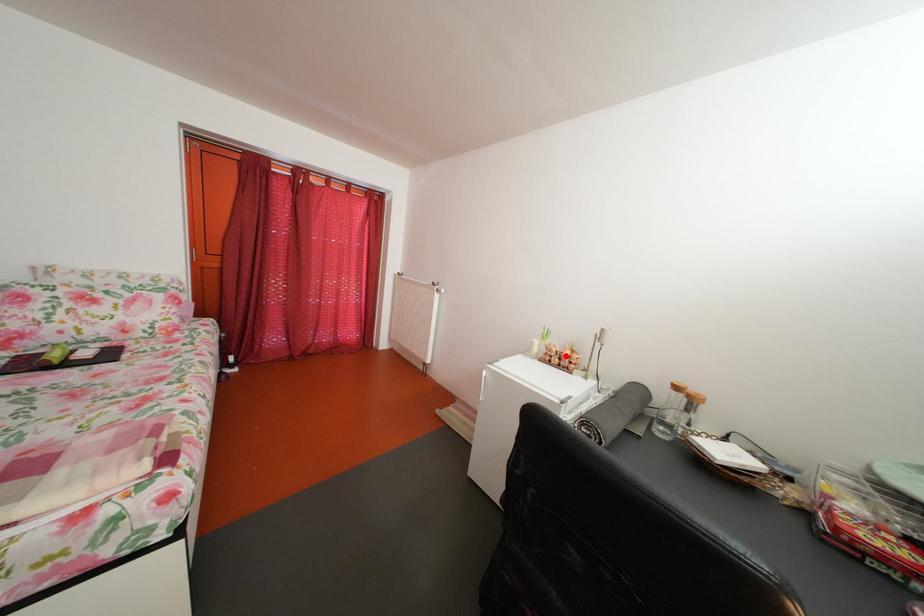
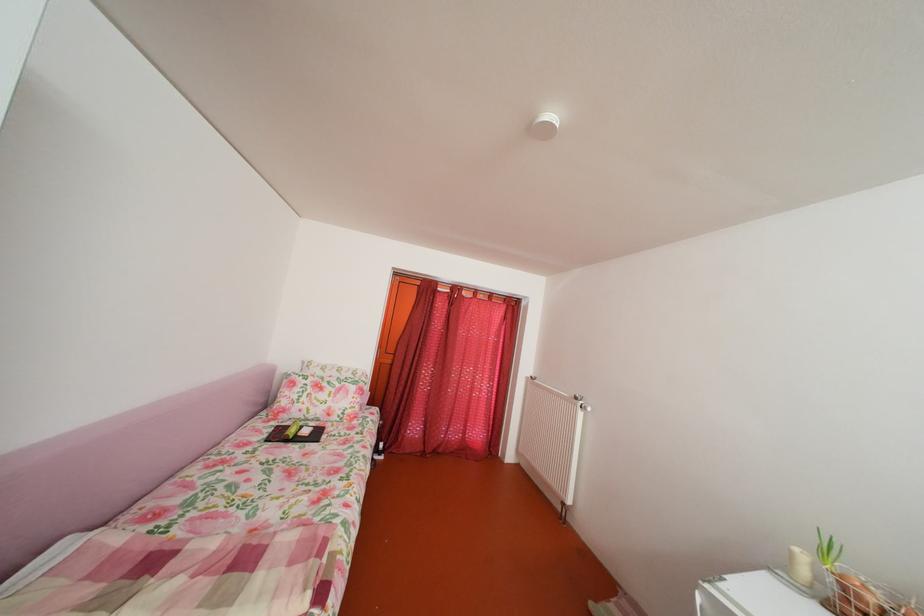
Question: I am providing you with two images of the same scene from different viewpoints. A red point is shown in image1. For the corresponding object point in image2, is it positioned nearer or farther from the camera?

Choices:
 (A) Nearer
 (B) Farther

Answer: (A)